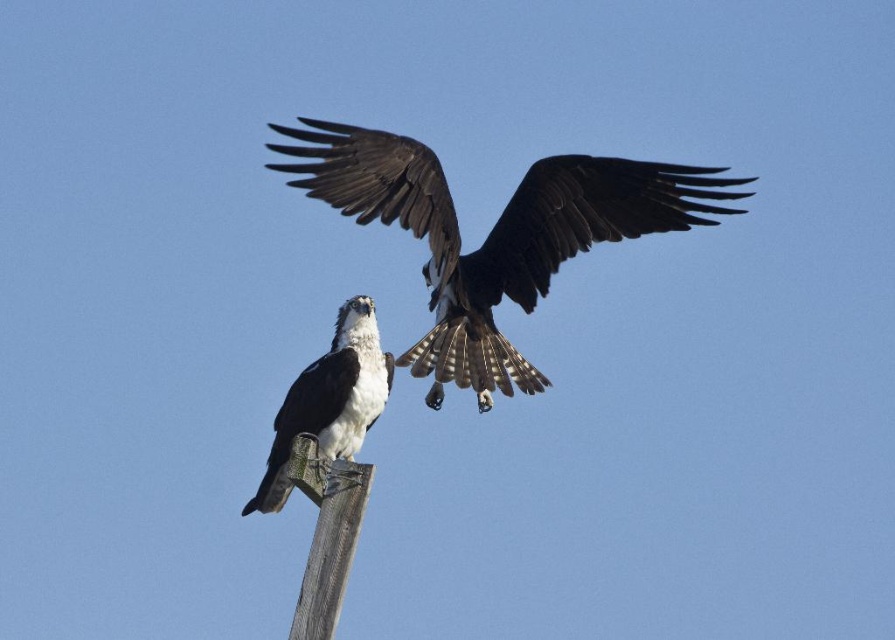
Question: Does dark brown feathers at center appear on the right side of dark brown feathered wing at upper right?

Choices:
 (A) yes
 (B) no

Answer: (B)

Question: Is white-feathered eagle at center positioned at the back of wooden post at center?

Choices:
 (A) yes
 (B) no

Answer: (A)

Question: Which object appears closest to the camera in this image?

Choices:
 (A) wooden post at center
 (B) dark brown feathers at upper center
 (C) white-feathered eagle at center

Answer: (B)

Question: Which point is farther to the camera?

Choices:
 (A) wooden post at center
 (B) dark brown feathers at center
 (C) white-feathered eagle at center
 (D) dark brown feathers at upper center

Answer: (C)

Question: Is the position of dark brown feathers at center less distant than that of white-feathered eagle at center?

Choices:
 (A) no
 (B) yes

Answer: (B)

Question: Among these objects, which one is nearest to the camera?

Choices:
 (A) white-feathered eagle at center
 (B) wooden post at center
 (C) dark brown feathers at upper center
 (D) dark brown feathered wing at upper right

Answer: (C)